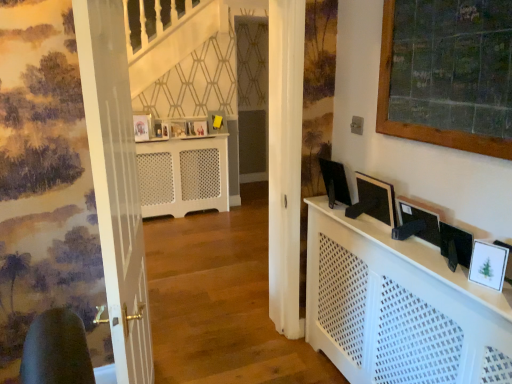
What do you see at coordinates (455, 246) in the screenshot? The image size is (512, 384). I see `matte black monitor at right, the 3th computer monitor from the back` at bounding box center [455, 246].

Measure the distance between point (387, 58) and camera.

The depth of point (387, 58) is 1.81 meters.

This screenshot has width=512, height=384. I want to click on matte wooden picture frame at upper center, the 2th picture frame viewed from the front, so click(x=143, y=126).

Measure the distance between white perforated cabinet at center and camera.

The distance of white perforated cabinet at center from camera is 4.18 feet.

The image size is (512, 384). In order to click on matte black monitor at right, the 3th computer monitor from the back in this screenshot , I will do `click(455, 246)`.

Based on the photo, is white perforated cabinet at center touching matte wooden picture frame at center, the third picture frame when ordered from bottom to top?

No, white perforated cabinet at center is not with matte wooden picture frame at center, the third picture frame when ordered from bottom to top.

From the image's perspective, between white perforated cabinet at center and matte wooden picture frame at center, which ranks as the 4th picture frame in right-to-left order, who is located below?

white perforated cabinet at center is shown below in the image.

Find the location of a particular element. The image size is (512, 384). cabinetry that is below the matte wooden picture frame at center, placed as the third picture frame when sorted from top to bottom (from the image's perspective) is located at coordinates (398, 307).

Consider the image. Which object is wider, white perforated cabinet at center or matte wooden picture frame at center, arranged as the 3th picture frame when viewed from the back?

white perforated cabinet at center.

From the image's perspective, who appears lower, matte wooden picture frame at center, arranged as the 3th picture frame when viewed from the back, or matte yellow picture frame at center, which appears as the first picture frame when viewed from the back?

matte wooden picture frame at center, arranged as the 3th picture frame when viewed from the back.

Does point (177, 136) come in front of point (222, 122)?

Yes, it is.

Is matte yellow picture frame at center, which is the 5th picture frame in front-to-back order, a part of matte wooden picture frame at center, the second picture frame viewed from the left?

No, matte yellow picture frame at center, which is the 5th picture frame in front-to-back order, is not a part of matte wooden picture frame at center, the second picture frame viewed from the left.

From a real-world perspective, who is located higher, matte wooden picture frame at center, which ranks as the 4th picture frame in right-to-left order, or matte yellow picture frame at center, which is the 1th picture frame in top-to-bottom order?

matte yellow picture frame at center, which is the 1th picture frame in top-to-bottom order, from a real-world perspective.

Between point (165, 142) and point (332, 200), which one is positioned behind?

Positioned behind is point (165, 142).

Considering their positions, is white perforated radiator at center located in front of or behind black glossy monitor at right, the 3th computer monitor from the front?

white perforated radiator at center is positioned farther from the viewer than black glossy monitor at right, the 3th computer monitor from the front.

Does white perforated radiator at center have a greater width compared to black glossy monitor at right, placed as the 1th computer monitor when sorted from left to right?

Yes, white perforated radiator at center is wider than black glossy monitor at right, placed as the 1th computer monitor when sorted from left to right.

Is white perforated radiator at center further to the viewer compared to matte black monitor at right, placed as the 3th computer monitor when sorted from left to right?

Yes, the depth of white perforated radiator at center is greater than that of matte black monitor at right, placed as the 3th computer monitor when sorted from left to right.

Who is shorter, white perforated radiator at center or matte black monitor at right, which is the 1th computer monitor in right-to-left order?

Standing shorter between the two is matte black monitor at right, which is the 1th computer monitor in right-to-left order.

Is white perforated radiator at center aimed at matte black monitor at right, the 3th computer monitor from the back?

Yes, white perforated radiator at center is oriented towards matte black monitor at right, the 3th computer monitor from the back.

Image resolution: width=512 pixels, height=384 pixels. What are the coordinates of `the 3rd computer monitor to the right when counting from the white perforated radiator at center` in the screenshot? It's located at (455, 246).

Between matte wooden picture frame at upper center, which appears as the second picture frame when ordered from the bottom, and white glossy door at left, which one is positioned in front?

white glossy door at left is closer to the camera.

Is matte wooden picture frame at upper center, the 1th picture frame when ordered from left to right, to the left or to the right of white glossy door at left in the image?

Result: Clearly, matte wooden picture frame at upper center, the 1th picture frame when ordered from left to right, is on the left of white glossy door at left in the image.

Is matte wooden picture frame at upper center, which appears as the second picture frame when ordered from the bottom, in contact with white glossy door at left?

They are not placed beside each other.

Image resolution: width=512 pixels, height=384 pixels. In order to click on door in front of the matte wooden picture frame at upper center, which appears as the 4th picture frame when viewed from the back in this screenshot , I will do `click(115, 183)`.

Would you say white perforated radiator at center is inside or outside matte white picture frame at center, the 4th picture frame in the front-to-back sequence?

white perforated radiator at center exists outside the volume of matte white picture frame at center, the 4th picture frame in the front-to-back sequence.

Which is more to the left, white perforated radiator at center or matte white picture frame at center, which appears as the second picture frame when viewed from the back?

From the viewer's perspective, white perforated radiator at center appears more on the left side.

How much distance is there between white perforated radiator at center and matte white picture frame at center, the 4th picture frame in the front-to-back sequence?

The distance of white perforated radiator at center from matte white picture frame at center, the 4th picture frame in the front-to-back sequence, is 19.46 inches.

Is white perforated radiator at center wider than matte white picture frame at center, the fourth picture frame when ordered from bottom to top?

Yes, white perforated radiator at center is wider than matte white picture frame at center, the fourth picture frame when ordered from bottom to top.

Based on their positions, is matte black monitor at right, placed as the 3th computer monitor when sorted from left to right, located to the left or right of white glossy door at left?

Based on their positions, matte black monitor at right, placed as the 3th computer monitor when sorted from left to right, is located to the right of white glossy door at left.

Between point (447, 246) and point (136, 177), which one is positioned behind?

Point (136, 177)

Is matte black monitor at right, which is the first computer monitor from front to back, positioned with its back to white glossy door at left?

That's not correct — matte black monitor at right, which is the first computer monitor from front to back, is not looking away from white glossy door at left.

From the picture: In terms of size, does matte black monitor at right, which is the first computer monitor from front to back, appear bigger or smaller than white glossy door at left?

Considering their sizes, matte black monitor at right, which is the first computer monitor from front to back, takes up less space than white glossy door at left.

Locate an element on the screen. The height and width of the screenshot is (384, 512). cabinetry below the matte wooden picture frame at center, arranged as the 3th picture frame when viewed from the front (from the image's perspective) is located at coordinates (398, 307).

From the matte yellow picture frame at center, marked as the second picture frame in a right-to-left arrangement, count the 2nd picture frame to the left and point to it. Please provide its 2D coordinates.

[(178, 129)]

From the image, which object appears to be nearer to matte white picture frame at center, which appears as the second picture frame when viewed from the back, wooden framed chalkboard at upper right or matte black monitor at right, placed as the 2th computer monitor when sorted from right to left?

Among the two, matte black monitor at right, placed as the 2th computer monitor when sorted from right to left, is located nearer to matte white picture frame at center, which appears as the second picture frame when viewed from the back.

Which object lies further to the anchor point white glossy picture frame at lower right, acting as the 1th picture frame starting from the bottom, matte black monitor at right, placed as the 2th computer monitor when sorted from right to left, or black glossy monitor at right, the 3th computer monitor from the front?

Among the two, black glossy monitor at right, the 3th computer monitor from the front, is located further to white glossy picture frame at lower right, acting as the 1th picture frame starting from the bottom.

Which object lies further to the anchor point white glossy picture frame at lower right, the fifth picture frame from the top, white perforated cabinet at center or matte white picture frame at center, the 2th picture frame viewed from the top?

matte white picture frame at center, the 2th picture frame viewed from the top, lies further to white glossy picture frame at lower right, the fifth picture frame from the top, than the other object.

Based on their spatial positions, is wooden framed chalkboard at upper right or matte white picture frame at center, positioned as the 3th picture frame in right-to-left order, closer to white glossy door at left?

wooden framed chalkboard at upper right is closer to white glossy door at left.

Consider the image. Which object lies further to the anchor point matte black monitor at right, placed as the 2th computer monitor when sorted from right to left, matte white picture frame at center, positioned as the 3th picture frame in left-to-right order, or white perforated cabinet at center?

matte white picture frame at center, positioned as the 3th picture frame in left-to-right order.

Based on their spatial positions, is matte wooden picture frame at center, which ranks as the 4th picture frame in right-to-left order, or matte black monitor at right, placed as the 2th computer monitor when sorted from right to left, further from matte wooden picture frame at upper center, which is counted as the 4th picture frame, starting from the top?

matte black monitor at right, placed as the 2th computer monitor when sorted from right to left.

Which object lies nearer to the anchor point matte black monitor at right, which is the 2th computer monitor in front-to-back order, black glossy monitor at right, the 1th computer monitor when ordered from back to front, or matte wooden picture frame at center, which ranks as the 4th picture frame in right-to-left order?

A: Among the two, black glossy monitor at right, the 1th computer monitor when ordered from back to front, is located nearer to matte black monitor at right, which is the 2th computer monitor in front-to-back order.

When comparing their distances from white glossy picture frame at lower right, the fifth picture frame from the top, does matte black monitor at right, placed as the 2th computer monitor when sorted from right to left, or matte wooden picture frame at upper center, the 1th picture frame when ordered from left to right, seem further?

matte wooden picture frame at upper center, the 1th picture frame when ordered from left to right, lies further to white glossy picture frame at lower right, the fifth picture frame from the top, than the other object.

The image size is (512, 384). In order to click on picture frame between black glossy monitor at right, the 1th computer monitor when ordered from back to front, and matte wooden picture frame at center, placed as the third picture frame when sorted from top to bottom, from front to back in this screenshot , I will do `click(143, 126)`.

The width and height of the screenshot is (512, 384). In order to click on picture frame positioned between matte black monitor at right, placed as the 2th computer monitor when sorted from right to left, and matte wooden picture frame at center, the third picture frame when ordered from bottom to top, from near to far in this screenshot , I will do point(143,126).

Find the location of `cabinetry between white glossy door at left and white glossy picture frame at lower right, arranged as the 1th picture frame when viewed from the right, from left to right`. cabinetry between white glossy door at left and white glossy picture frame at lower right, arranged as the 1th picture frame when viewed from the right, from left to right is located at coordinates (398, 307).

Identify the location of bulletin board between white glossy door at left and matte white picture frame at center, the 2th picture frame viewed from the top, in the front-back direction. (422, 125).